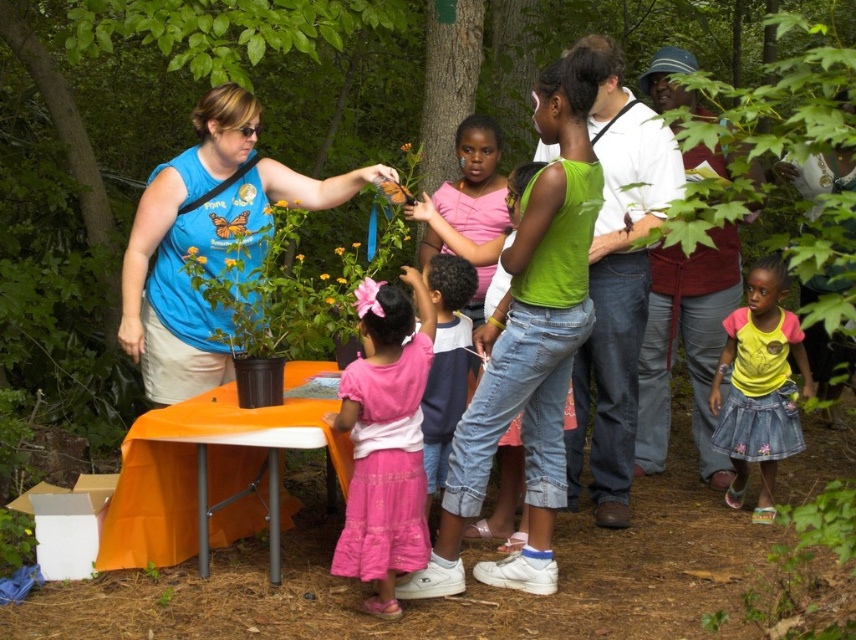
Question: Which object is farther from the camera taking this photo?

Choices:
 (A) blue t-shirt at center
 (B) yellow denim skirt at lower right
 (C) maroon fabric shirt at center
 (D) orange fabric picnic table at center

Answer: (C)

Question: Among these points, which one is farthest from the camera?

Choices:
 (A) (545, 129)
 (B) (706, 253)
 (C) (768, 515)

Answer: (B)

Question: Does pink satin dress at center have a larger size compared to pink fabric shirt at center?

Choices:
 (A) yes
 (B) no

Answer: (A)

Question: Which is nearer to the pink satin dress at center?

Choices:
 (A) pink fabric shirt at center
 (B) green sleeveless top at center

Answer: (A)

Question: Is green sleeveless top at center below yellow denim skirt at lower right?

Choices:
 (A) no
 (B) yes

Answer: (A)

Question: Can you confirm if blue t-shirt at center is bigger than pink fabric shirt at center?

Choices:
 (A) yes
 (B) no

Answer: (A)